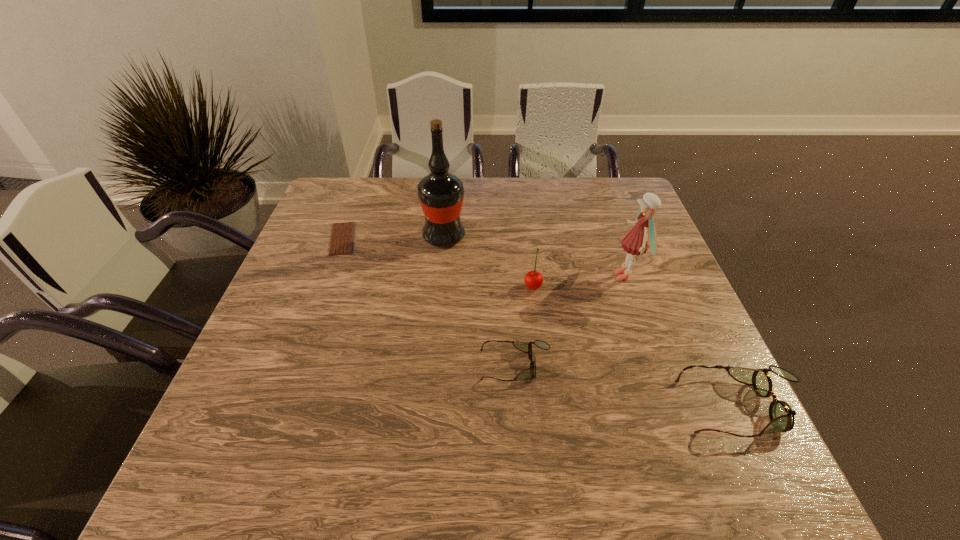
Where is `vacant area situated on the right of the second object from left to right`? The image size is (960, 540). vacant area situated on the right of the second object from left to right is located at coordinates (542, 237).

Image resolution: width=960 pixels, height=540 pixels. Identify the location of vacant space located on the back of the cherry. (523, 210).

The image size is (960, 540). What are the coordinates of `object at the near edge` in the screenshot? It's located at (781, 415).

The width and height of the screenshot is (960, 540). In order to click on object present at the left edge in this screenshot , I will do `click(341, 243)`.

Find the location of a particular element. spectacles that is at the right edge is located at coordinates (781, 415).

Image resolution: width=960 pixels, height=540 pixels. In order to click on doll that is at the right edge in this screenshot , I will do `click(636, 241)`.

The image size is (960, 540). I want to click on object at the near right corner, so click(781, 415).

Find the location of `free spot at the far edge of the desktop`. free spot at the far edge of the desktop is located at coordinates (475, 196).

Find the location of a particular element. The width and height of the screenshot is (960, 540). vacant position at the left edge of the desktop is located at coordinates coord(287,284).

In the image, there is a desktop. Identify the location of vacant space at the right edge. pos(649,270).